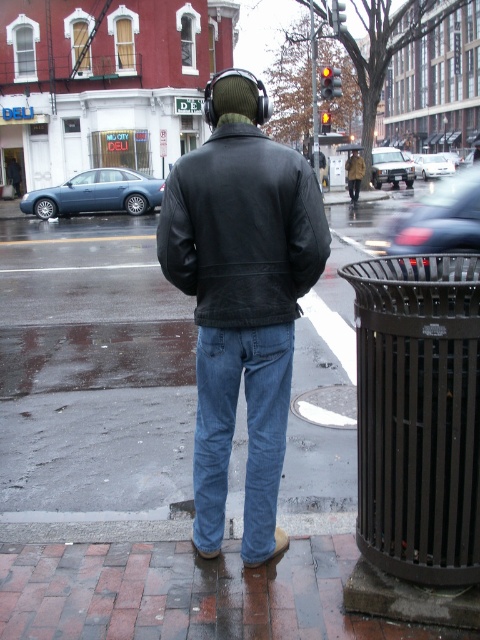
You are a fashion photographer who wants to capture the tan leather jacket at center and camouflage fabric jacket at center in a single shot. Since you can only focus on one jacket clearly, which one should you choose to ensure it appears sharp in the photo?

The tan leather jacket at center is closer to the viewer than the camouflage fabric jacket at center, so focusing on it will ensure it appears sharp while the other may be slightly blurred.

You are a delivery drone that needs to fly between the two points, point (355, 163) and point (359, 170). Which point should you fly towards first to stay closer to the viewer?

Point (355, 163) is further to the viewer than point (359, 170), so you should fly towards point (355, 163) first to stay closer to the viewer.

You are a delivery person needing to place a package on the sidewalk between the denim jeans at center and the matte blue sedan at left. Can you fit the package there?

The denim jeans at center is located below matte blue sedan at left, so the package can be placed between them on the sidewalk.